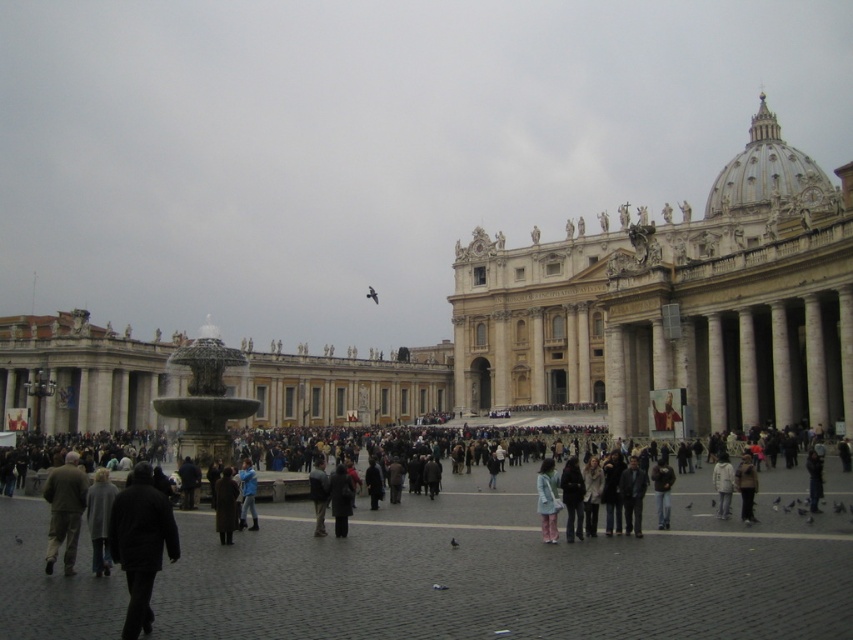
Question: Is dark gray coat at center above dark brown leather jacket at center?

Choices:
 (A) yes
 (B) no

Answer: (B)

Question: Can you confirm if dark gray fabric jacket at lower left is positioned below light blue fabric jacket at lower right?

Choices:
 (A) yes
 (B) no

Answer: (B)

Question: Which of the following is the farthest from the observer?

Choices:
 (A) white cotton jacket at lower right
 (B) dark gray fabric jacket at lower left

Answer: (A)

Question: Does dark gray jacket at center have a greater width compared to dark blue jacket at center?

Choices:
 (A) yes
 (B) no

Answer: (B)

Question: Among these points, which one is nearest to the camera?

Choices:
 (A) (550, 522)
 (B) (337, 515)

Answer: (A)

Question: Among these objects, which one is farthest from the camera?

Choices:
 (A) khaki fabric pants at lower left
 (B) beige stone palace at right
 (C) dark brown leather jacket at lower right
 (D) brown leather coat at center

Answer: (B)